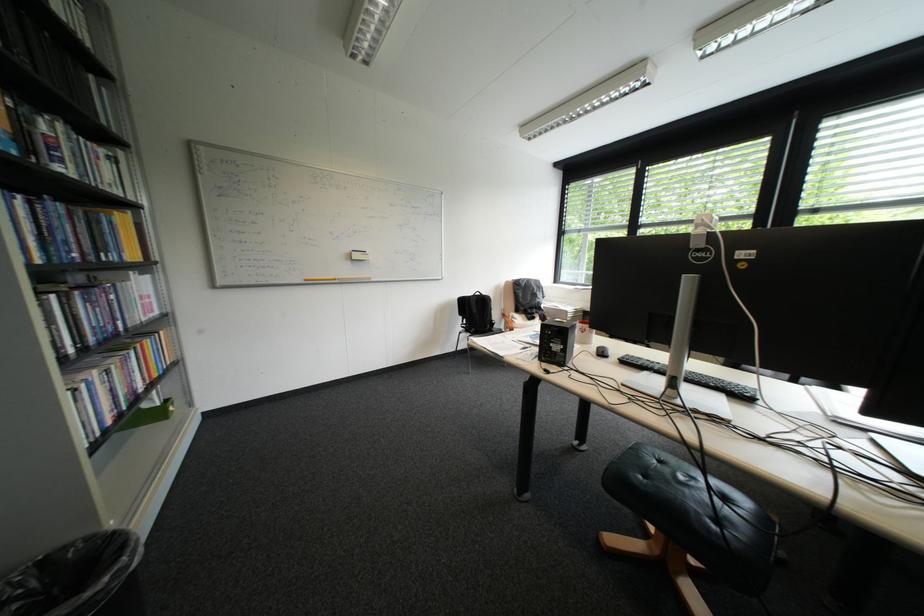
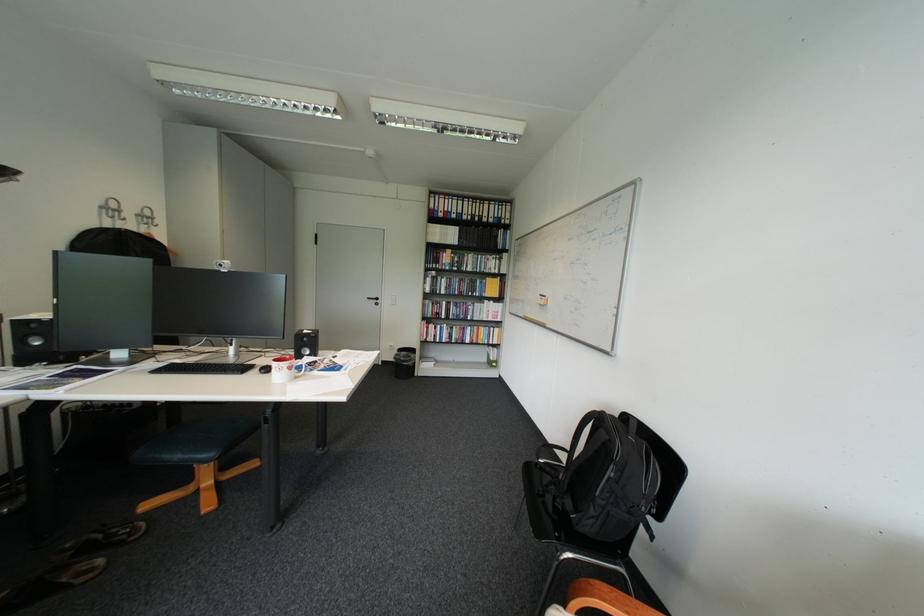
The point at (88, 138) is marked in the first image. Where is the corresponding point in the second image?

(489, 257)